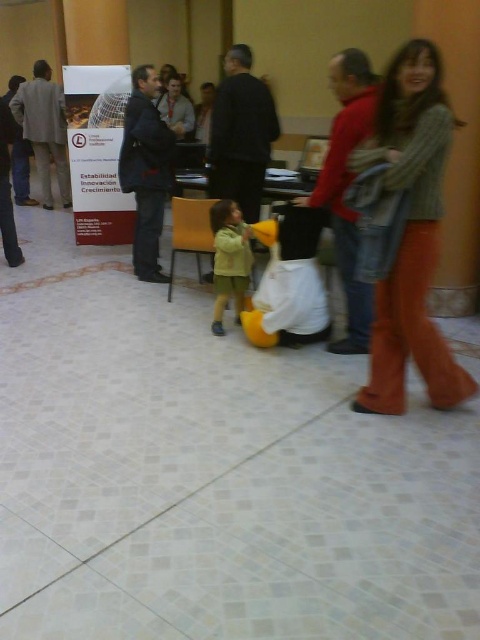
Who is higher up, matte gray suit at left or light green fabric jacket at center?

matte gray suit at left is higher up.

Between point (46, 205) and point (220, 228), which one is positioned behind?

The point (46, 205) is behind.

The height and width of the screenshot is (640, 480). What do you see at coordinates (45, 129) in the screenshot?
I see `matte gray suit at left` at bounding box center [45, 129].

Where is `matte gray suit at left`? The image size is (480, 640). matte gray suit at left is located at coordinates (45, 129).

Image resolution: width=480 pixels, height=640 pixels. What do you see at coordinates (406, 230) in the screenshot? I see `orange cotton pants at right` at bounding box center [406, 230].

Which is above, orange cotton pants at right or light green fabric jacket at center?

orange cotton pants at right is higher up.

Is point (437, 336) closer to camera compared to point (236, 230)?

Yes, it is.

Identify the location of orange cotton pants at right. (406, 230).

Is point (422, 323) positioned before point (39, 182)?

Yes.

The width and height of the screenshot is (480, 640). I want to click on orange cotton pants at right, so click(406, 230).